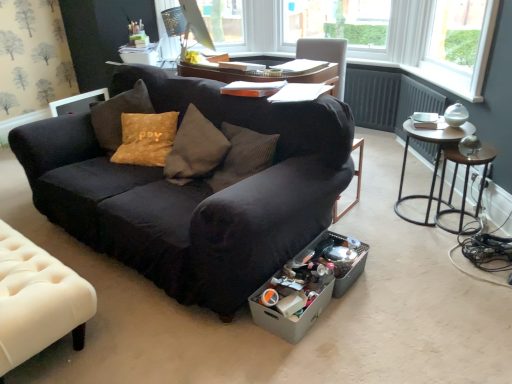
Where is `free space that is to the left of metallic round table at right`? The image size is (512, 384). free space that is to the left of metallic round table at right is located at coordinates (366, 213).